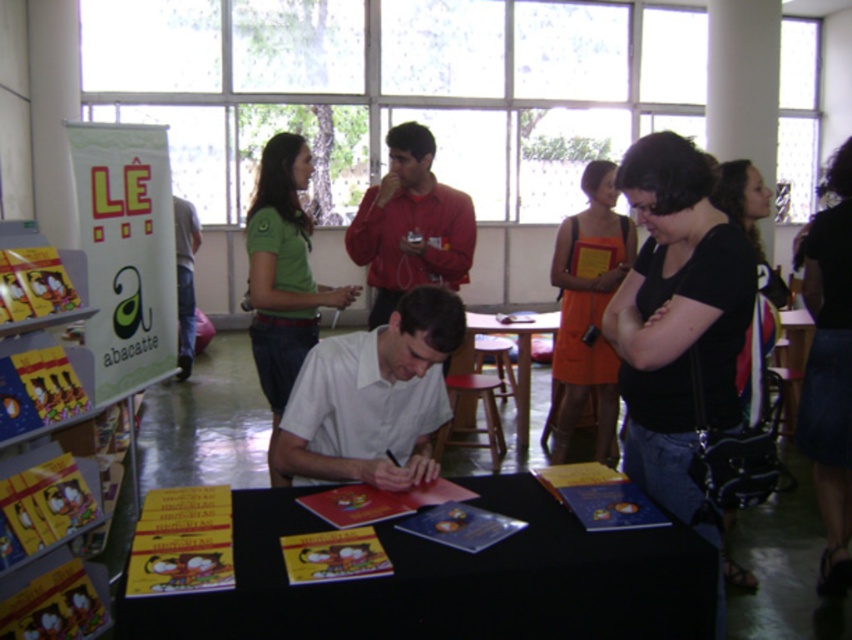
You are attending a book signing event and notice two items on the table. One is a matte red shirt at center and the other is jeans at left. Which item takes up more space on the table?

The matte red shirt at center is larger in size than jeans at left, so it takes up more space on the table.